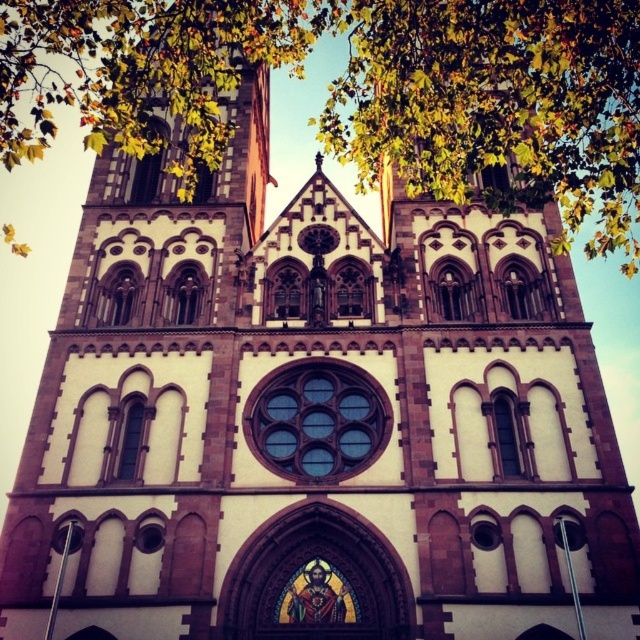
You are an architect analyzing the church facade. You notice the green leafy tree at upper center and the clear glass window at center. Which object occupies more space on the facade?

The green leafy tree at upper center occupies more space on the facade as it is larger in size than the clear glass window at center.

You are standing in front of the church and notice a point marked at coordinates (356, 90). Based on the church facade description, what object is located at that point?

The point at coordinates (356, 90) corresponds to the green leafy tree at upper center.

Consider the image. You are an architect analyzing the church facade. You notice the green leafy tree at upper center and the clear glass window at center. Which object is taller?

The green leafy tree at upper center is taller than the clear glass window at center.